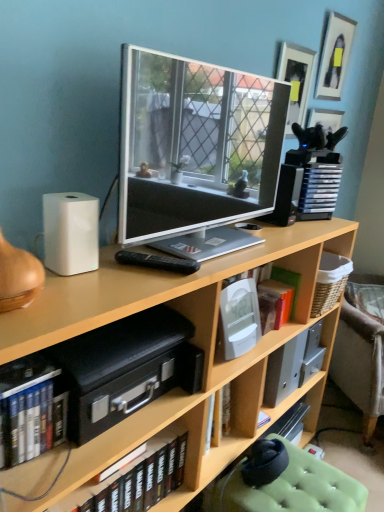
The height and width of the screenshot is (512, 384). What are the coordinates of `free area in between matte silver tv at center and black plastic remote at center` in the screenshot? It's located at (233, 259).